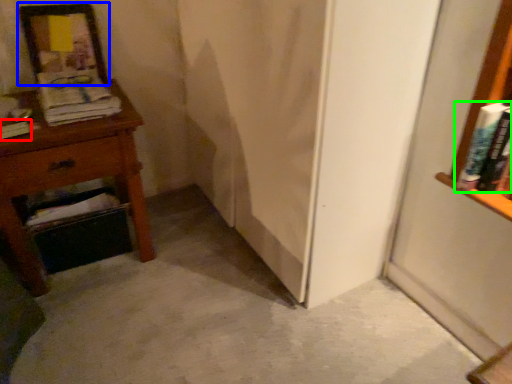
Question: Considering the real-world distances, which object is farthest from book (highlighted by a red box)? picture frame (highlighted by a blue box) or book (highlighted by a green box)?

Choices:
 (A) picture frame
 (B) book

Answer: (B)